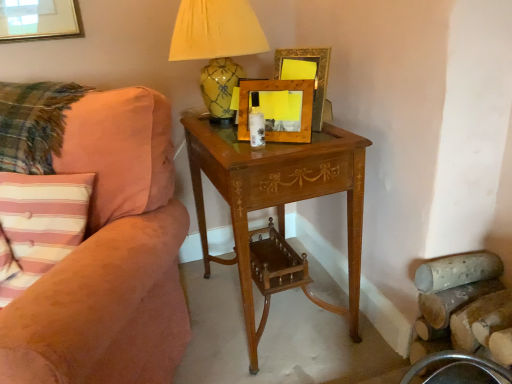
Find the location of a particular element. The image size is (512, 384). vacant region to the left of wooden picture frame at center, arranged as the 1th picture frame when viewed from the front is located at coordinates (227, 143).